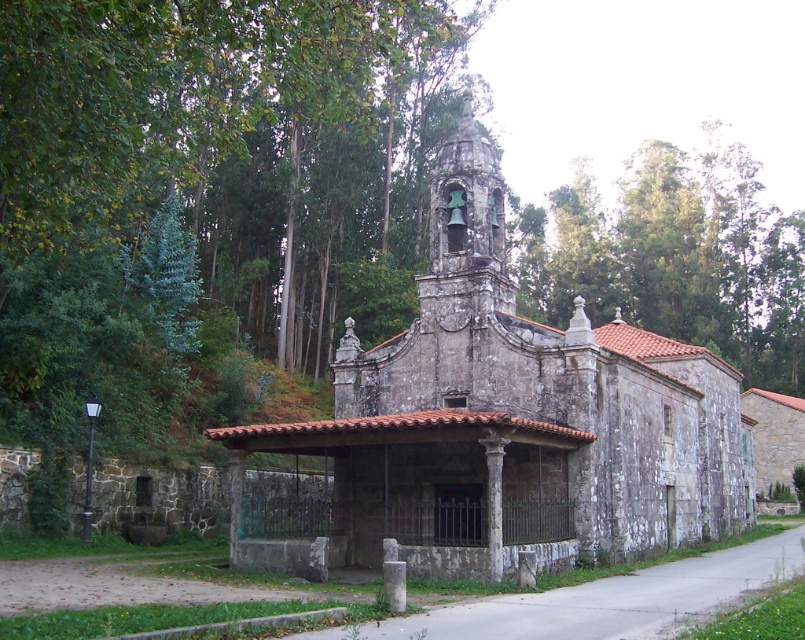
Consider the image. You are a drone operator who needs to fly a drone from the stone church at center to the green leafy tree at upper center. The drone has a maximum flight range of 250 feet. Can the drone reach the tree without needing to recharge?

The stone church at center is 271.70 feet from the green leafy tree at upper center, so the drone cannot reach the tree without recharging since the distance exceeds its 250 feet range.

You are standing in front of the stone church at center and looking towards the green leafy tree at upper center. Is the tree above or below the church?

The stone church at center is located below the green leafy tree at upper center, so the tree is above the church.